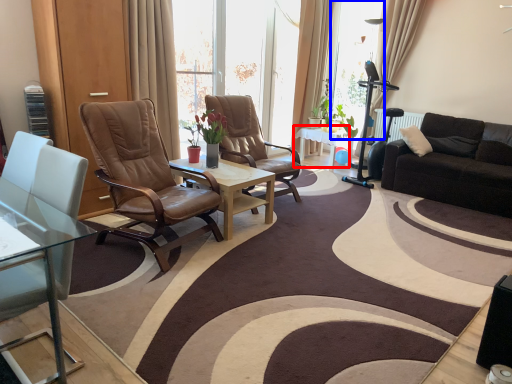
Question: Which object is further to the camera taking this photo, table (highlighted by a red box) or window screen (highlighted by a blue box)?

Choices:
 (A) table
 (B) window screen

Answer: (B)